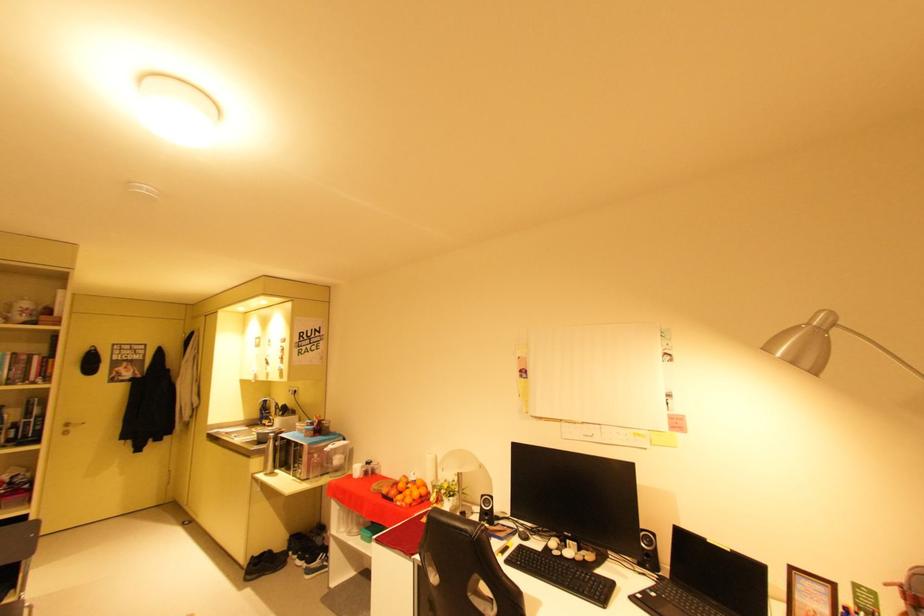
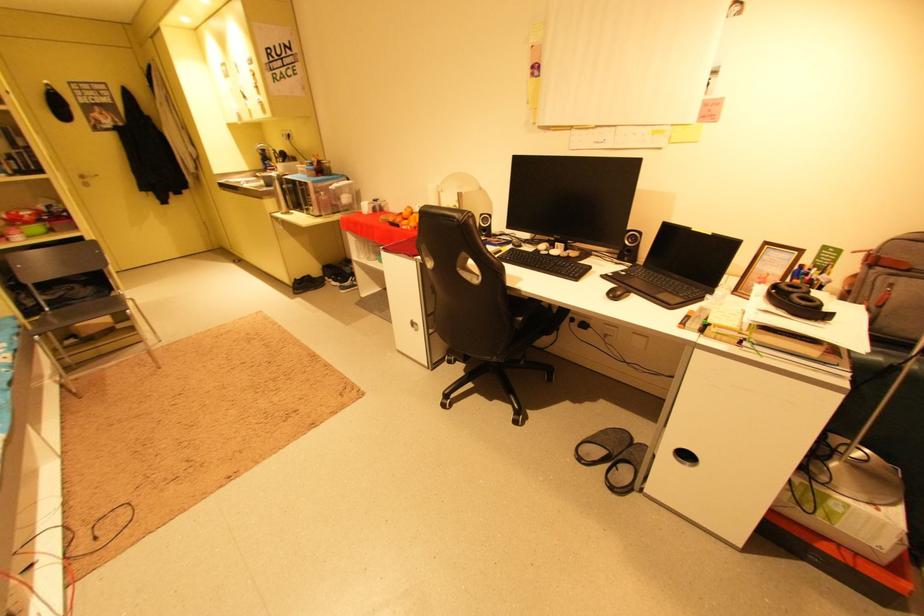
The point at (78, 429) is marked in the first image. Where is the corresponding point in the second image?

(93, 180)